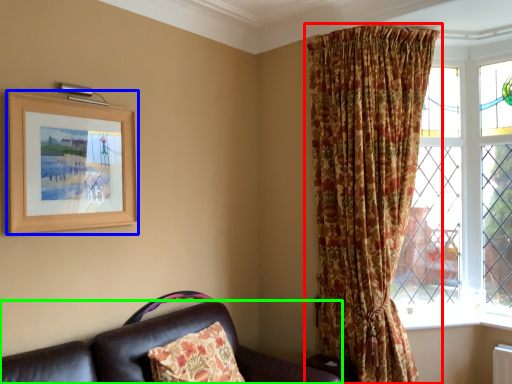
Question: Which object is the closest to the curtain (highlighted by a red box)? Choose among these: picture frame (highlighted by a blue box) or studio couch (highlighted by a green box).

Choices:
 (A) picture frame
 (B) studio couch

Answer: (B)